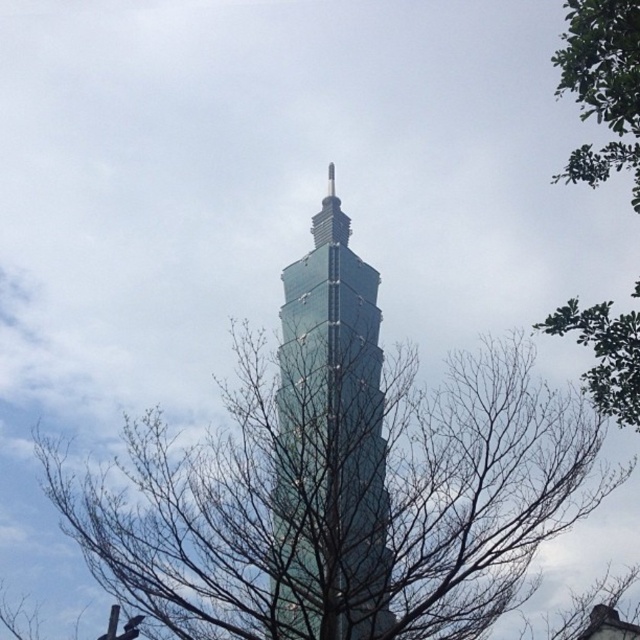
Does bare branches at center have a larger size compared to green leafy tree at upper right?

Yes.

Which is more to the left, bare branches at center or green leafy tree at upper right?

From the viewer's perspective, bare branches at center appears more on the left side.

Does point (275, 529) come farther from viewer compared to point (630, 355)?

Yes, it is.

Locate an element on the screen. bare branches at center is located at coordinates (337, 502).

Can you confirm if bare branches at center is thinner than green glass tower at center?

No, bare branches at center is not thinner than green glass tower at center.

Who is more distant from viewer, [195,515] or [316,620]?

Point [195,515]

Find the location of a particular element. The width and height of the screenshot is (640, 640). bare branches at center is located at coordinates (337, 502).

Is green glass tower at center smaller than green leafy tree at upper right?

Correct, green glass tower at center occupies less space than green leafy tree at upper right.

The height and width of the screenshot is (640, 640). Describe the element at coordinates (332, 435) in the screenshot. I see `green glass tower at center` at that location.

Find the location of a particular element. This screenshot has width=640, height=640. green glass tower at center is located at coordinates (332, 435).